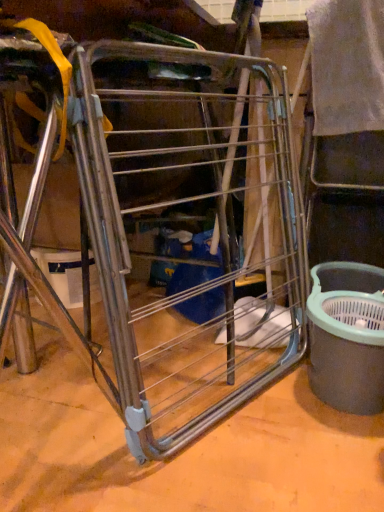
Question: Do you think gray plastic bucket at right is within metal wire rack at center, or outside of it?

Choices:
 (A) outside
 (B) inside

Answer: (A)

Question: Considering their positions, is gray plastic bucket at right located in front of or behind metal wire rack at center?

Choices:
 (A) front
 (B) behind

Answer: (B)

Question: From a real-world perspective, is gray plastic bucket at right positioned above or below metal wire rack at center?

Choices:
 (A) below
 (B) above

Answer: (A)

Question: Based on their positions, is metal wire rack at center located to the left or right of gray plastic bucket at right?

Choices:
 (A) left
 (B) right

Answer: (A)

Question: Considering their positions, is metal wire rack at center located in front of or behind gray plastic bucket at right?

Choices:
 (A) behind
 (B) front

Answer: (B)

Question: From a real-world perspective, is metal wire rack at center above or below gray plastic bucket at right?

Choices:
 (A) below
 (B) above

Answer: (B)

Question: Considering the positions of metal wire rack at center and gray plastic bucket at right in the image, is metal wire rack at center bigger or smaller than gray plastic bucket at right?

Choices:
 (A) small
 (B) big

Answer: (B)